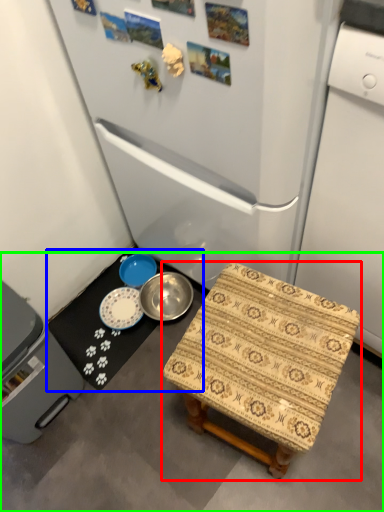
Question: Which is nearer to the furniture (highlighted by a red box)? table (highlighted by a blue box) or concrete (highlighted by a green box).

Choices:
 (A) table
 (B) concrete

Answer: (B)